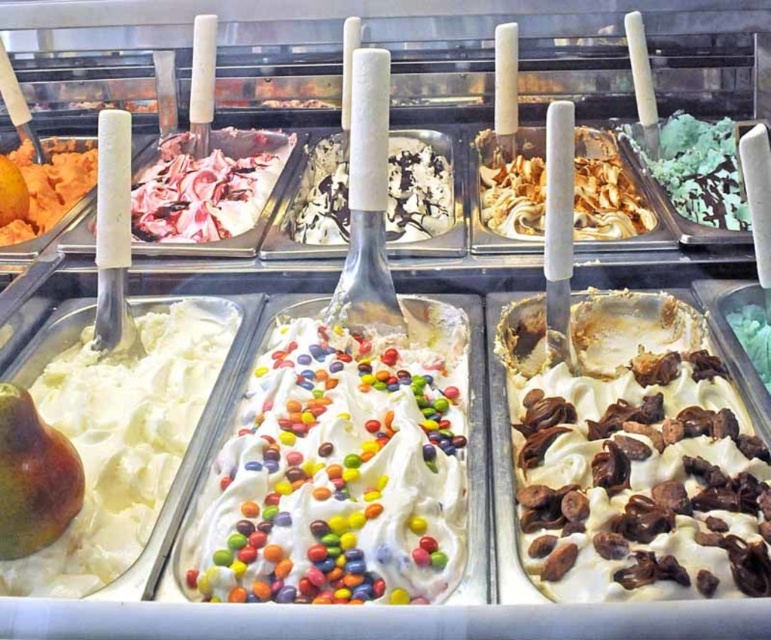
Consider the image. You are at an ice cream display case and want to choose between the whipped cream with chocolate chips at center and the white creamy ice cream at left. If you want the one that is on the right side, which one should you pick?

You should pick the whipped cream with chocolate chips at center because it is positioned on the right side of the white creamy ice cream at left.

You are a customer at an ice cream shop and want to know if you can reach both the whipped cream with chocolate chips at center and the white creamy ice cream at left with a single serving spoon that is 24 inches long. Can you do it?

The whipped cream with chocolate chips at center and white creamy ice cream at left are 28.24 inches apart from each other. Since the spoon is only 24 inches long, it is not long enough to reach both items simultaneously.

You are at an ice cream shop and want to point out the location of the whipped cream with chocolate chips at center and the white creamy ice cream with colorful candies at center. Which one is placed higher in the display case?

Result: The whipped cream with chocolate chips at center is placed higher than the white creamy ice cream with colorful candies at center in the display case.